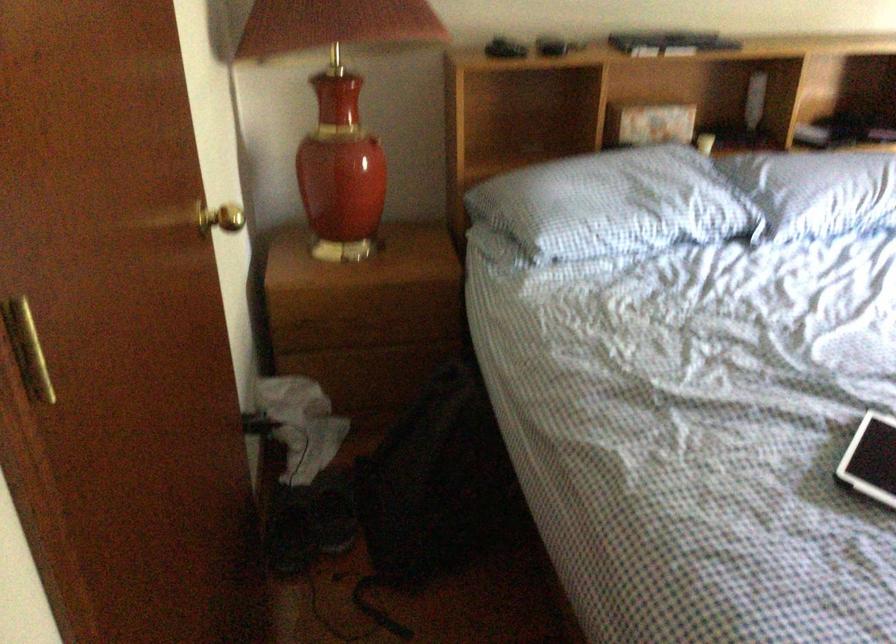
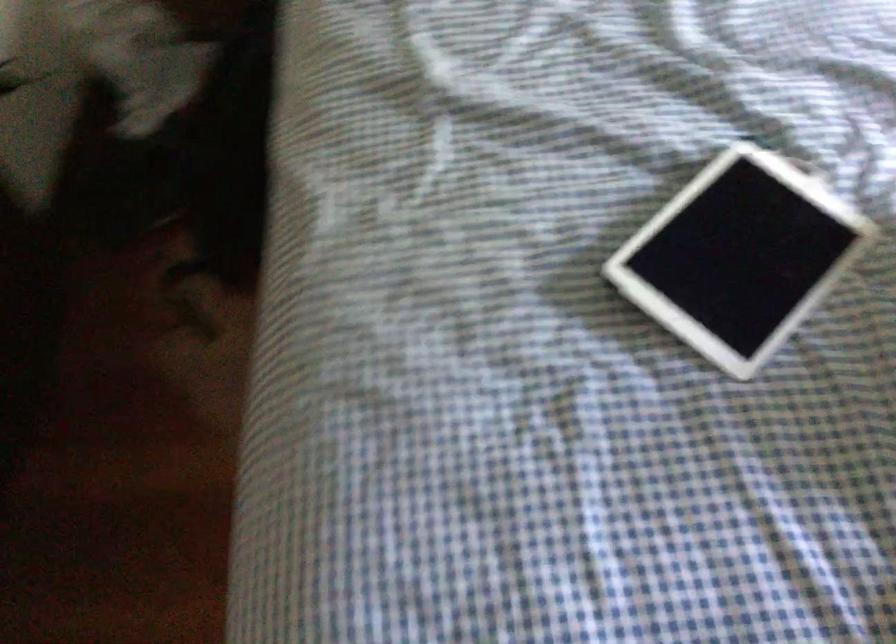
Question: The images are taken continuously from a first-person perspective. In which direction is your viewpoint rotating?

Choices:
 (A) Left
 (B) Right
 (C) Up
 (D) Down

Answer: (D)